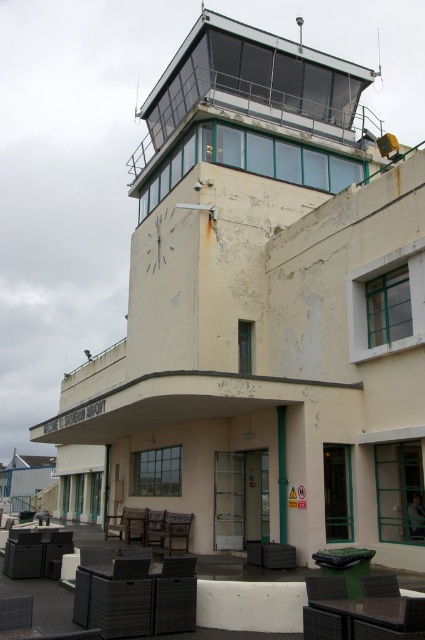
Does matte black chair at lower left appear under brown wooden chair at lower center?

Actually, matte black chair at lower left is above brown wooden chair at lower center.

Between point (11, 636) and point (142, 513), which one is positioned behind?

The point (142, 513) is more distant.

Find the location of a particular element. matte black chair at lower left is located at coordinates (31, 621).

The width and height of the screenshot is (425, 640). In order to click on matte black chair at lower left in this screenshot , I will do `click(31, 621)`.

Can you confirm if matte black chair at lower left is positioned to the right of brown woven chair at lower center?

In fact, matte black chair at lower left is to the left of brown woven chair at lower center.

Does matte black chair at lower left have a lesser height compared to brown woven chair at lower center?

Yes, matte black chair at lower left is shorter than brown woven chair at lower center.

Measure the distance between point (0, 616) and camera.

23.32 feet

Locate an element on the screen. This screenshot has height=640, width=425. matte black chair at lower left is located at coordinates (31, 621).

Does brown woven chair at lower center appear over brown wooden chair at lower center?

Yes.

Is brown woven chair at lower center closer to camera compared to brown wooden chair at lower center?

Yes, it is.

You are a GUI agent. You are given a task and a screenshot of the screen. Output one action in this format:
    pyautogui.click(x=<x>, y=<y>)
    Task: Click on the brown woven chair at lower center
    
    Given the screenshot: What is the action you would take?
    pyautogui.click(x=170, y=531)